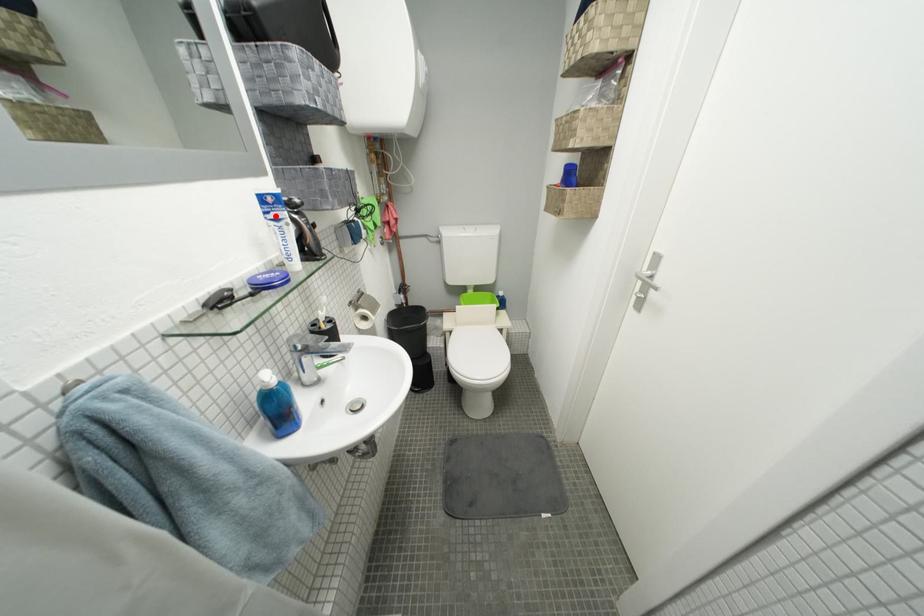
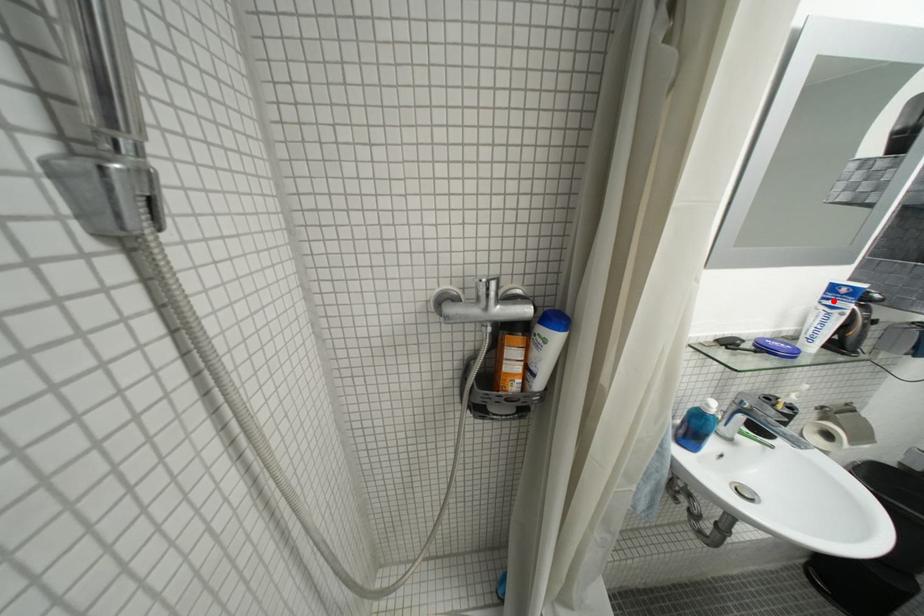
In the scene shown: I am providing you with two images of the same scene from different viewpoints. A red point is marked on the first image and another point is marked on the second image. Are the points marked in image1 and image2 representing the same 3D position?

Yes